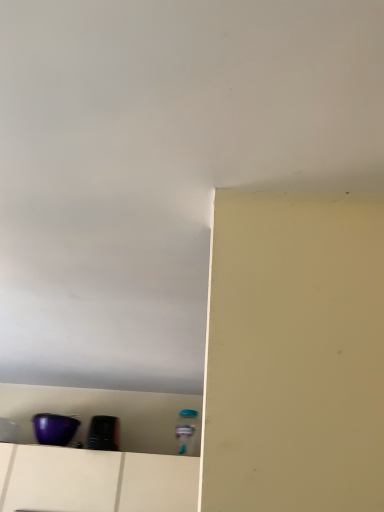
Question: In the image, is purple plastic container at lower left on the left side or the right side of black glossy toaster at lower left, positioned as the first appliance in right-to-left order?

Choices:
 (A) left
 (B) right

Answer: (A)

Question: From a real-world perspective, relative to black glossy toaster at lower left, the 2th appliance in the left-to-right sequence, is purple plastic container at lower left vertically above or below?

Choices:
 (A) below
 (B) above

Answer: (A)

Question: Which object is positioned closest to the white matte drawer at lower left?

Choices:
 (A) black glossy toaster at lower left, the 2th appliance in the left-to-right sequence
 (B) purple plastic container at lower left
 (C) purple glossy bowl at lower left, the 2th appliance from the right

Answer: (B)

Question: Which is farther from the black glossy toaster at lower left, the 2th appliance in the left-to-right sequence?

Choices:
 (A) purple plastic container at lower left
 (B) purple glossy bowl at lower left, the 2th appliance from the right
 (C) white matte drawer at lower left

Answer: (C)